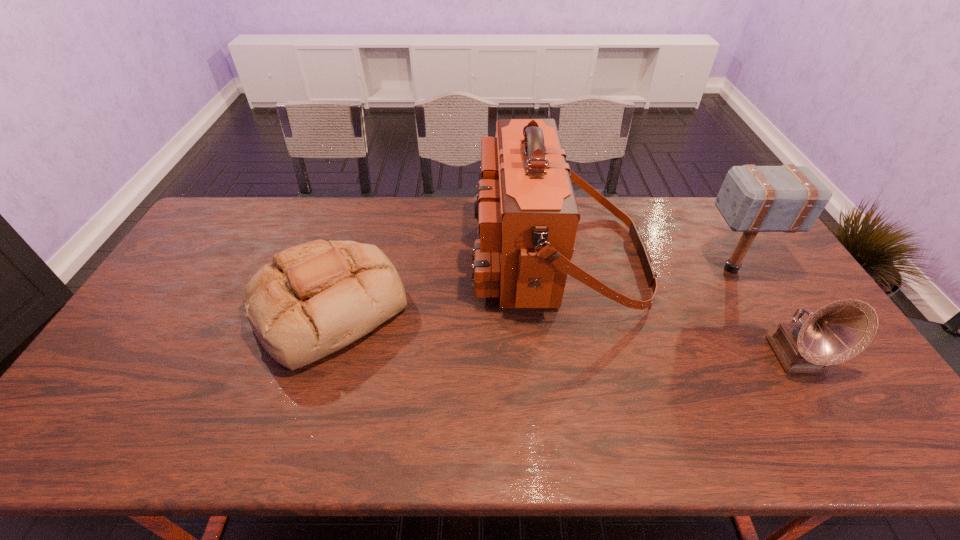
Locate an element on the screen. satchel is located at coordinates (527, 213).

The width and height of the screenshot is (960, 540). In order to click on the third object from right to left in this screenshot , I will do `click(527, 213)`.

The image size is (960, 540). I want to click on the third shortest object, so click(788, 198).

Image resolution: width=960 pixels, height=540 pixels. I want to click on the third tallest object, so click(x=837, y=332).

You are a GUI agent. You are given a task and a screenshot of the screen. Output one action in this format:
    pyautogui.click(x=<x>, y=<y>)
    Task: Click on the shortest object
    
    Given the screenshot: What is the action you would take?
    pyautogui.click(x=315, y=298)

The height and width of the screenshot is (540, 960). Find the location of `the leftmost object`. the leftmost object is located at coordinates (315, 298).

Where is `free space located on the face side of the satchel`? The height and width of the screenshot is (540, 960). free space located on the face side of the satchel is located at coordinates (373, 259).

Locate an element on the screen. vacant space located 0.390m on the face side of the satchel is located at coordinates (352, 259).

In order to click on vacant area situated on the face side of the satchel in this screenshot , I will do `click(447, 259)`.

Find the location of a particular element. vacant space located 0.270m on the striking surface of the third shortest object is located at coordinates (612, 269).